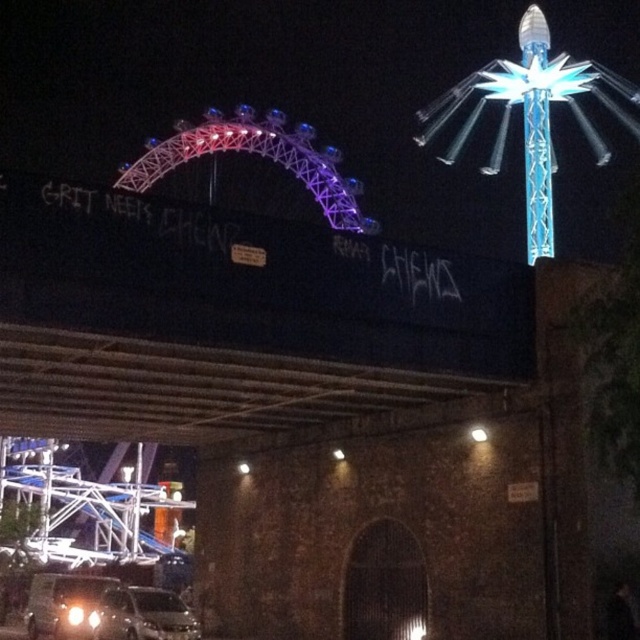
Based on the photo, who is positioned more to the left, metallic silver car at lower left or white glossy headlight at lower left?

From the viewer's perspective, white glossy headlight at lower left appears more on the left side.

Who is taller, metallic silver car at lower left or white glossy headlight at lower left?

metallic silver car at lower left is taller.

Measure the distance between metallic silver car at lower left and camera.

metallic silver car at lower left is 51.05 meters away from camera.

Locate an element on the screen. metallic silver car at lower left is located at coordinates (141, 614).

Is metallic silver car at lower left to the left of shiny silver car at lower left from the viewer's perspective?

Incorrect, metallic silver car at lower left is not on the left side of shiny silver car at lower left.

Is metallic silver car at lower left positioned at the back of shiny silver car at lower left?

No, metallic silver car at lower left is closer to the viewer.

Is point (120, 637) positioned behind point (51, 609)?

No.

The height and width of the screenshot is (640, 640). Find the location of `metallic silver car at lower left`. metallic silver car at lower left is located at coordinates (141, 614).

Can you confirm if shiny silver car at lower left is shorter than white glossy headlight at lower left?

In fact, shiny silver car at lower left may be taller than white glossy headlight at lower left.

Is shiny silver car at lower left further to camera compared to white glossy headlight at lower left?

That is False.

Who is more forward, (42, 572) or (67, 609)?

Point (67, 609) is more forward.

What are the coordinates of `shiny silver car at lower left` in the screenshot? It's located at (64, 604).